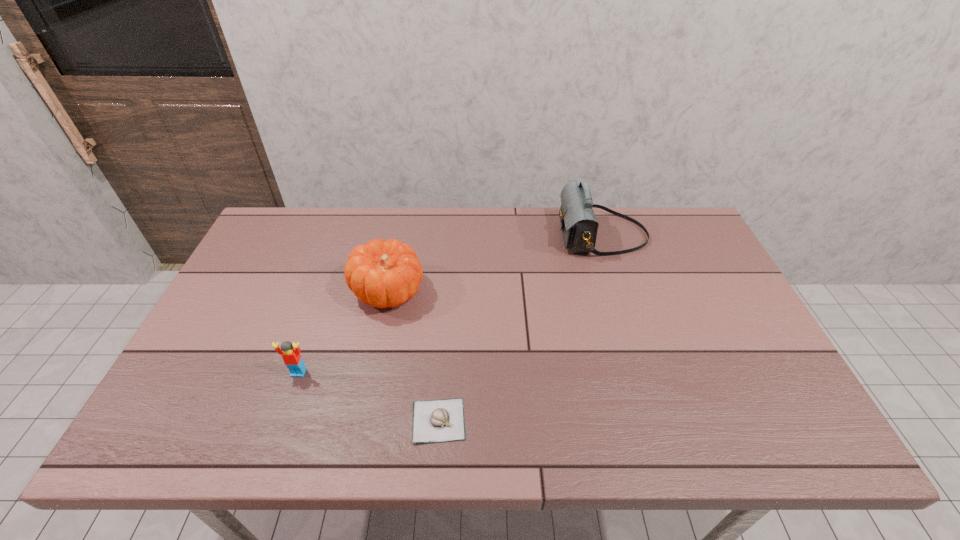
You are a GUI agent. You are given a task and a screenshot of the screen. Output one action in this format:
    pyautogui.click(x=<x>, y=<y>)
    Task: Click on the rightmost object
    The image size is (960, 540).
    Given the screenshot: What is the action you would take?
    pyautogui.click(x=579, y=226)

The width and height of the screenshot is (960, 540). Identify the location of shoulder bag. (579, 226).

This screenshot has height=540, width=960. Find the location of `the second farthest object`. the second farthest object is located at coordinates (383, 274).

This screenshot has width=960, height=540. What are the coordinates of `the third shortest object` in the screenshot? It's located at (383, 274).

The width and height of the screenshot is (960, 540). In order to click on Lego in this screenshot , I will do `click(291, 356)`.

You are a GUI agent. You are given a task and a screenshot of the screen. Output one action in this format:
    pyautogui.click(x=<x>, y=<y>)
    Task: Click on the second nearest object
    Image resolution: width=960 pixels, height=540 pixels.
    Given the screenshot: What is the action you would take?
    pyautogui.click(x=291, y=356)

The height and width of the screenshot is (540, 960). In order to click on the nearest object in this screenshot , I will do [442, 420].

Identify the location of garlic. The height and width of the screenshot is (540, 960). (442, 420).

Identify the location of free space located on the front of the rightmost object. Image resolution: width=960 pixels, height=540 pixels. (640, 357).

Locate an element on the screen. This screenshot has height=540, width=960. vacant space situated 0.100m on the left of the third object from right to left is located at coordinates (318, 292).